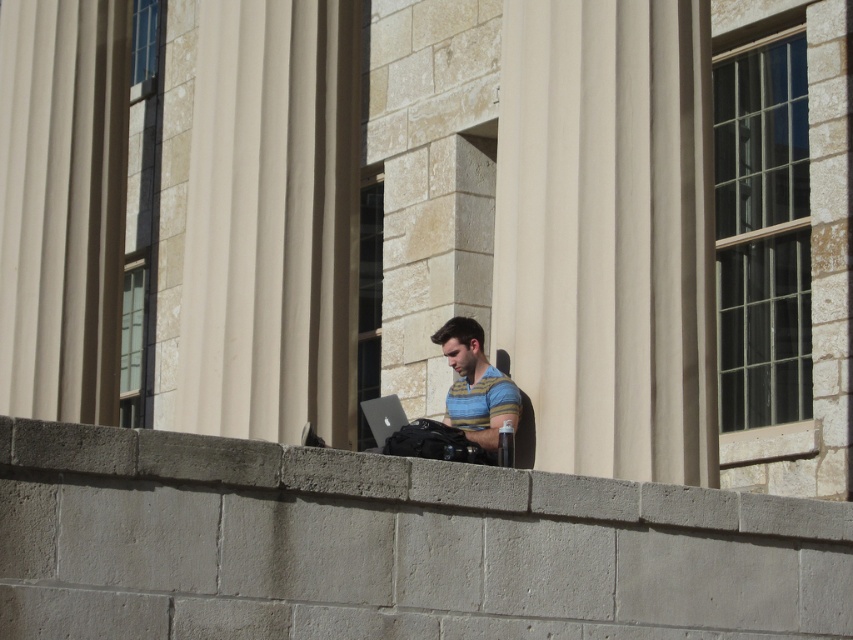
Is smooth stone pillar at center above striped cotton shirt at center?

Yes.

You are a GUI agent. You are given a task and a screenshot of the screen. Output one action in this format:
    pyautogui.click(x=<x>, y=<y>)
    Task: Click on the smooth stone pillar at center
    The image size is (853, 640).
    Given the screenshot: What is the action you would take?
    pyautogui.click(x=608, y=234)

Where is `smooth stone pillar at center`? The width and height of the screenshot is (853, 640). smooth stone pillar at center is located at coordinates (608, 234).

Between point (622, 488) and point (467, 346), which one is positioned behind?

Point (467, 346)

Identify the location of concrete ledge at center. click(407, 481).

Is smooth stone pillar at center closer to the viewer compared to concrete ledge at center?

No, it is behind concrete ledge at center.

What do you see at coordinates (608, 234) in the screenshot? I see `smooth stone pillar at center` at bounding box center [608, 234].

In order to click on smooth stone pillar at center in this screenshot , I will do pyautogui.click(x=608, y=234).